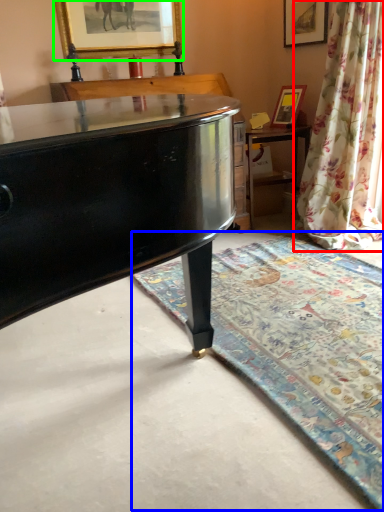
Question: Estimate the real-world distances between objects in this image. Which object is closer to curtain (highlighted by a red box), mat (highlighted by a blue box) or picture frame (highlighted by a green box)?

Choices:
 (A) mat
 (B) picture frame

Answer: (A)